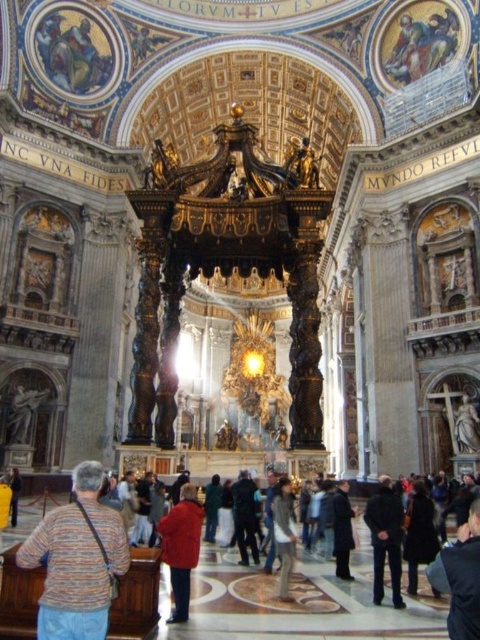
Question: Which of the following is the closest to the observer?

Choices:
 (A) dark brown leather jacket at lower right
 (B) dark brown leather jacket at center
 (C) striped sweater at lower left

Answer: (C)

Question: Does dark brown leather jacket at lower right come behind dark brown leather jacket at center?

Choices:
 (A) no
 (B) yes

Answer: (B)

Question: Can you confirm if striped sweater at lower left is positioned below dark brown leather jacket at lower right?

Choices:
 (A) yes
 (B) no

Answer: (B)

Question: Which of the following is the closest to the observer?

Choices:
 (A) dark brown leather coat at center
 (B) dark brown leather jacket at center
 (C) dark brown leather jacket at lower right

Answer: (B)

Question: Which is nearer to the dark brown leather jacket at center?

Choices:
 (A) dark brown leather jacket at lower right
 (B) dark gray fabric jacket at lower right

Answer: (B)

Question: Does striped sweater at lower left appear on the right side of dark brown leather jacket at lower right?

Choices:
 (A) yes
 (B) no

Answer: (B)